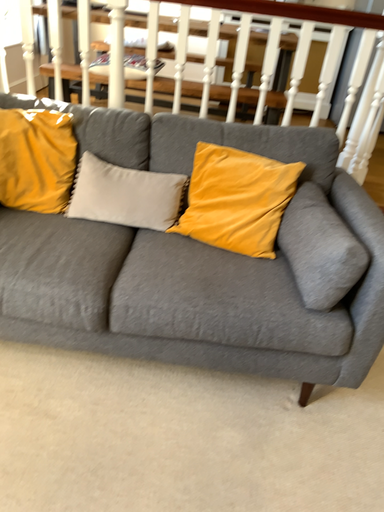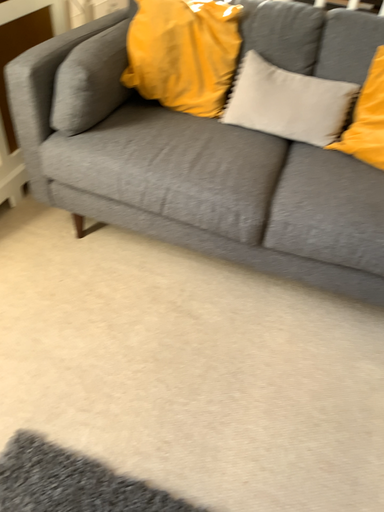
Question: Which way did the camera rotate in the video?

Choices:
 (A) rotated left
 (B) rotated right

Answer: (A)